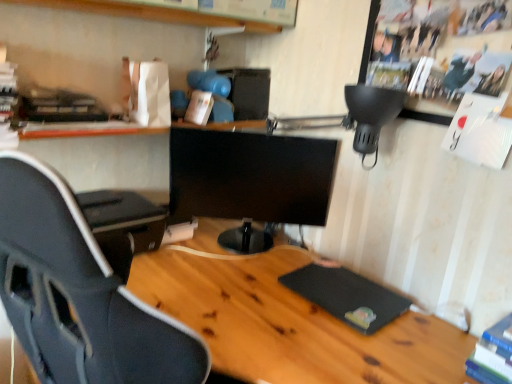
Question: Is black rubber mousepad at lower right oriented towards wooden shelf at upper center?

Choices:
 (A) yes
 (B) no

Answer: (B)

Question: Can you confirm if black rubber mousepad at lower right is positioned to the left of wooden shelf at upper center?

Choices:
 (A) no
 (B) yes

Answer: (A)

Question: Is wooden shelf at upper center surrounded by black rubber mousepad at lower right?

Choices:
 (A) no
 (B) yes

Answer: (A)

Question: From a real-world perspective, is black rubber mousepad at lower right beneath wooden shelf at upper center?

Choices:
 (A) yes
 (B) no

Answer: (A)

Question: Is black rubber mousepad at lower right behind wooden shelf at upper center?

Choices:
 (A) no
 (B) yes

Answer: (B)

Question: Is black rubber mousepad at lower right thinner than wooden shelf at upper center?

Choices:
 (A) yes
 (B) no

Answer: (B)

Question: Is wooden shelf at upper center further to the viewer compared to blue hardcover book at lower right, marked as the first book in a right-to-left arrangement?

Choices:
 (A) no
 (B) yes

Answer: (B)

Question: Considering the relative sizes of wooden shelf at upper center and blue hardcover book at lower right, which ranks as the second book in top-to-bottom order, in the image provided, is wooden shelf at upper center thinner than blue hardcover book at lower right, which ranks as the second book in top-to-bottom order,?

Choices:
 (A) no
 (B) yes

Answer: (A)

Question: From the image's perspective, is wooden shelf at upper center below blue hardcover book at lower right, marked as the first book in a right-to-left arrangement?

Choices:
 (A) yes
 (B) no

Answer: (B)

Question: Is wooden shelf at upper center positioned before blue hardcover book at lower right, which ranks as the second book in top-to-bottom order?

Choices:
 (A) yes
 (B) no

Answer: (B)

Question: Considering the relative sizes of wooden shelf at upper center and blue hardcover book at lower right, the 1th book positioned from the front, in the image provided, is wooden shelf at upper center taller than blue hardcover book at lower right, the 1th book positioned from the front,?

Choices:
 (A) no
 (B) yes

Answer: (A)

Question: From the image's perspective, is wooden shelf at upper center on blue hardcover book at lower right, the 1th book positioned from the front?

Choices:
 (A) yes
 (B) no

Answer: (A)

Question: From the image's perspective, would you say black glossy monitor at center is shown under wooden shelf at upper center?

Choices:
 (A) no
 (B) yes

Answer: (B)